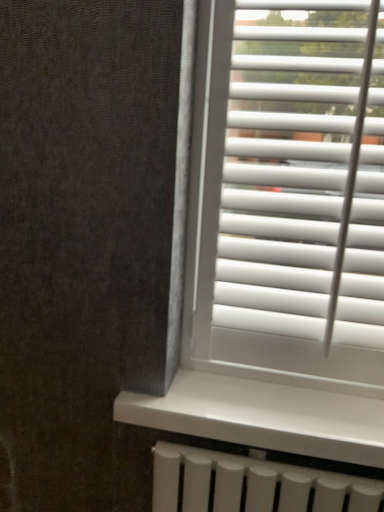
Image resolution: width=384 pixels, height=512 pixels. Identify the location of white plastic blinds at right. (305, 174).

What do you see at coordinates (305, 174) in the screenshot?
I see `white plastic blinds at right` at bounding box center [305, 174].

Find the location of a particular element. This screenshot has height=512, width=384. white smooth window sill at center is located at coordinates click(x=263, y=416).

Measure the distance between white smooth window sill at center and camera.

They are 74.40 centimeters apart.

What do you see at coordinates (263, 416) in the screenshot?
I see `white smooth window sill at center` at bounding box center [263, 416].

In order to face white smooth window sill at center, should I rotate leftwards or rightwards?

Rotate right and turn 8.055 degrees.

Identify the location of white plastic blinds at right. (305, 174).

Can you confirm if white smooth window sill at center is positioned to the right of white plastic blinds at right?

Incorrect, white smooth window sill at center is not on the right side of white plastic blinds at right.

Is white smooth window sill at center in front of or behind white plastic blinds at right in the image?

Visually, white smooth window sill at center is located behind white plastic blinds at right.

Is point (242, 434) more distant than point (230, 87)?

No, (242, 434) is closer to viewer.

From the image's perspective, which one is positioned lower, white smooth window sill at center or white plastic blinds at right?

white smooth window sill at center, from the image's perspective.

From a real-world perspective, is white smooth window sill at center beneath white plastic blinds at right?

Indeed, from a real-world perspective, white smooth window sill at center is positioned beneath white plastic blinds at right.

In the scene shown: Can you confirm if white smooth window sill at center is wider than white plastic blinds at right?

Correct, the width of white smooth window sill at center exceeds that of white plastic blinds at right.

Can you confirm if white smooth window sill at center is shorter than white plastic blinds at right?

Correct, white smooth window sill at center is not as tall as white plastic blinds at right.

Does white smooth window sill at center have a larger size compared to white plastic blinds at right?

Incorrect, white smooth window sill at center is not larger than white plastic blinds at right.

Is white smooth window sill at center completely or partially outside of white plastic blinds at right?

Yes.

Is white smooth window sill at center far away from white plastic blinds at right?

white smooth window sill at center is actually quite close to white plastic blinds at right.

Is white plastic blinds at right at the back of white smooth window sill at center?

No, white smooth window sill at center is not facing the opposite direction of white plastic blinds at right.

Measure the distance between white smooth window sill at center and white plastic blinds at right.

white smooth window sill at center is 12.49 inches away from white plastic blinds at right.

This screenshot has width=384, height=512. I want to click on window sill on the left side of white plastic blinds at right, so click(263, 416).

Which object is positioned more to the left, white plastic blinds at right or white smooth window sill at center?

From the viewer's perspective, white smooth window sill at center appears more on the left side.

Is the position of white plastic blinds at right less distant than that of white smooth window sill at center?

Yes.

Between point (273, 225) and point (270, 383), which one is positioned behind?

The point (270, 383) is more distant.

From the image's perspective, relative to white smooth window sill at center, is white plastic blinds at right above or below?

From the image's perspective, white plastic blinds at right appears above white smooth window sill at center.

From a real-world perspective, which object stands above the other?

white plastic blinds at right, from a real-world perspective.

Can you confirm if white plastic blinds at right is wider than white smooth window sill at center?

In fact, white plastic blinds at right might be narrower than white smooth window sill at center.

From the picture: In terms of height, does white plastic blinds at right look taller or shorter compared to white smooth window sill at center?

Considering their sizes, white plastic blinds at right has more height than white smooth window sill at center.

Does white plastic blinds at right have a larger size compared to white smooth window sill at center?

Indeed, white plastic blinds at right has a larger size compared to white smooth window sill at center.

Is white plastic blinds at right situated inside white smooth window sill at center or outside?

white plastic blinds at right is not enclosed by white smooth window sill at center.

Are white plastic blinds at right and white smooth window sill at center far apart?

white plastic blinds at right is near white smooth window sill at center, not far away.

Looking at this image, is white smooth window sill at center at the back of white plastic blinds at right?

No, white smooth window sill at center is not at the back of white plastic blinds at right.

Measure the distance between white plastic blinds at right and white smooth window sill at center.

white plastic blinds at right and white smooth window sill at center are 12.49 inches apart.

Locate an element on the screen. This screenshot has height=512, width=384. blind in front of the white smooth window sill at center is located at coordinates (305, 174).

Where is `blind located in front of the white smooth window sill at center`? Image resolution: width=384 pixels, height=512 pixels. blind located in front of the white smooth window sill at center is located at coordinates (305, 174).

You are a GUI agent. You are given a task and a screenshot of the screen. Output one action in this format:
    pyautogui.click(x=<x>, y=<y>)
    Task: Click on the window sill on the left of white plastic blinds at right
    The width and height of the screenshot is (384, 512).
    Given the screenshot: What is the action you would take?
    pyautogui.click(x=263, y=416)